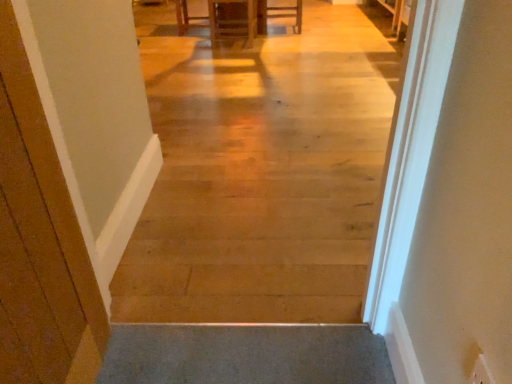
Question: Do you think matte wooden chair at center, positioned as the first furniture in right-to-left order, is within wooden table at center, or outside of it?

Choices:
 (A) outside
 (B) inside

Answer: (B)

Question: Looking at the image, does matte wooden chair at center, marked as the 2th furniture in a left-to-right arrangement, seem bigger or smaller compared to wooden table at center?

Choices:
 (A) small
 (B) big

Answer: (A)

Question: Which is farther from the wooden table at center?

Choices:
 (A) matte wooden chair at center, marked as the 2th furniture in a left-to-right arrangement
 (B) wooden floor at center
 (C) matte wood cabinet at center, the first furniture positioned from the left

Answer: (B)

Question: Estimate the real-world distances between objects in this image. Which object is farther from the matte wooden chair at center, which is the 1th furniture from back to front?

Choices:
 (A) wooden floor at center
 (B) matte wood cabinet at center, the first furniture positioned from the left
 (C) wooden table at center

Answer: (A)